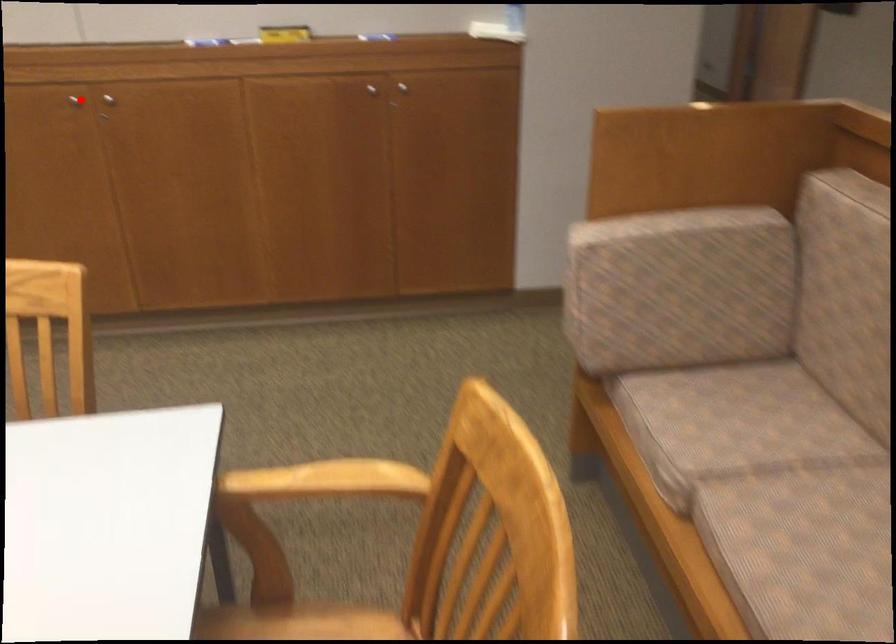
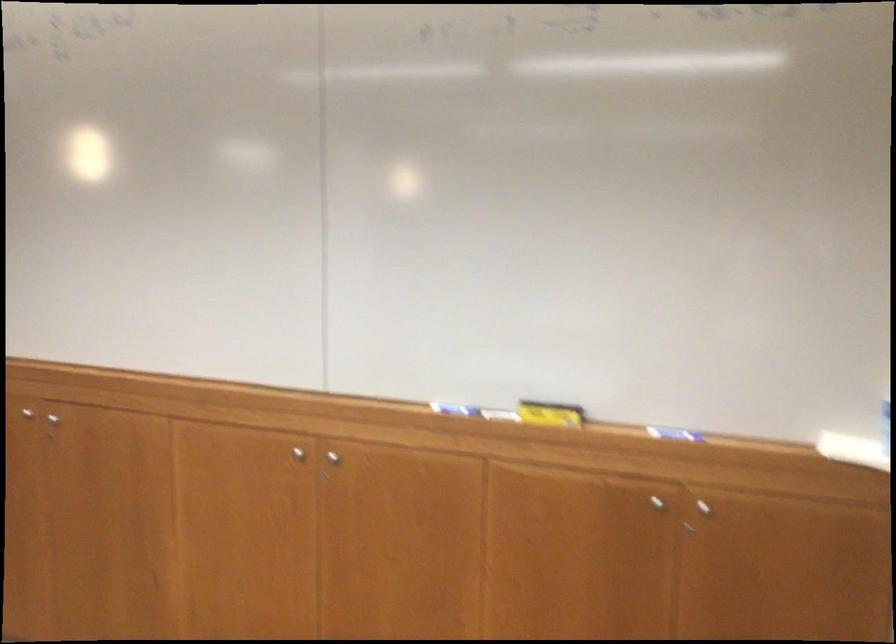
Question: A red point is marked in image1. In image2, is the corresponding 3D point closer to the camera or farther? Reply with the corresponding letter.

Choices:
 (A) The corresponding 3D point is closer.
 (B) The corresponding 3D point is farther.

Answer: (A)